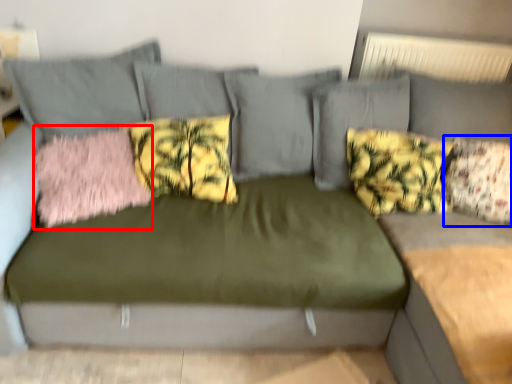
Question: Which object is closer to the camera taking this photo, pillow (highlighted by a red box) or pillow (highlighted by a blue box)?

Choices:
 (A) pillow
 (B) pillow

Answer: (A)